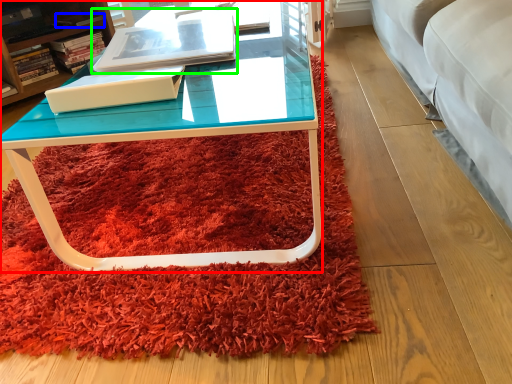
Question: Which object is positioned farthest from coffee table (highlighted by a red box)? Select from book (highlighted by a blue box) and book (highlighted by a green box).

Choices:
 (A) book
 (B) book

Answer: (A)